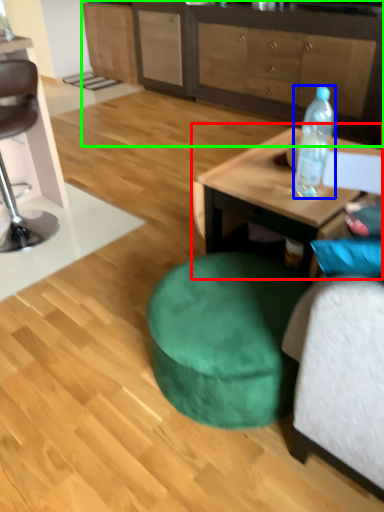
Question: Based on their relative distances, which object is farther from coffee table (highlighted by a red box)? Choose from bottle (highlighted by a blue box) and cabinetry (highlighted by a green box).

Choices:
 (A) bottle
 (B) cabinetry

Answer: (B)